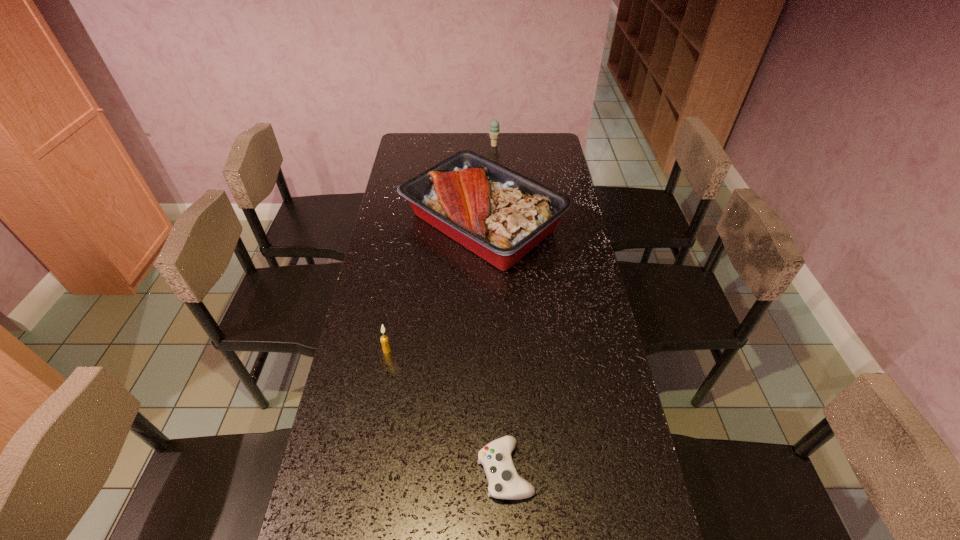
Where is `tray`? tray is located at coordinates (500, 215).

Find the location of a particular element. This screenshot has width=960, height=540. the tallest object is located at coordinates (500, 215).

Where is `the farthest object`? the farthest object is located at coordinates (494, 132).

Identify the location of the second nearest object. (384, 339).

Image resolution: width=960 pixels, height=540 pixels. I want to click on the shortest object, so click(504, 482).

Find the location of `the nearest object`. the nearest object is located at coordinates (504, 482).

At what (x,y) coordinates should I click in order to perform the action: click on vacant area situated on the back of the third nearest object. Please return your answer as a coordinate pair (x, y). This screenshot has width=960, height=540. Looking at the image, I should click on (482, 161).

The width and height of the screenshot is (960, 540). I want to click on free space located on the right of the farthest object, so click(538, 145).

Locate an element on the screen. The height and width of the screenshot is (540, 960). free region located 0.250m on the back of the second nearest object is located at coordinates (398, 285).

The image size is (960, 540). I want to click on free space located on the back of the control, so click(500, 336).